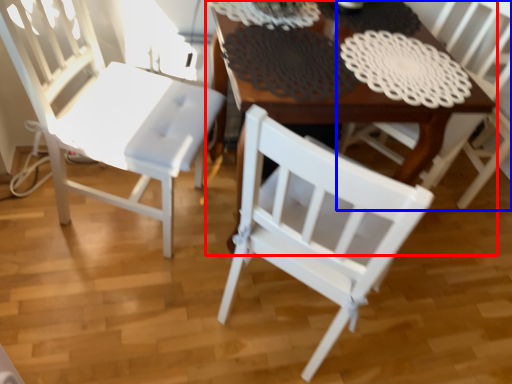
Question: Which of the following is the closest to the observer, table (highlighted by a red box) or chair (highlighted by a blue box)?

Choices:
 (A) table
 (B) chair

Answer: (A)